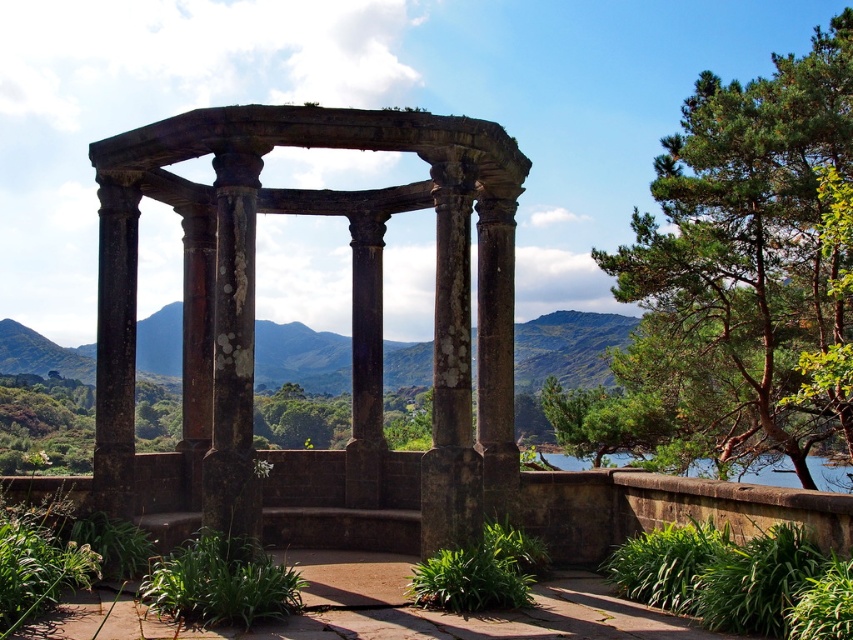
You are standing in the paved area near the dark brown stone gazebo at center and want to take a photo of the green textured tree at upper right. Which direction should you face to capture the tree in your view?

You should face to the right because the green textured tree at upper right is located to the right side of the dark brown stone gazebo at center.

You are planning to install a new pathway between the dark brown stone gazebo at center and the dense cluster of shrubs on the right. The pathway needs to be exactly 60 feet long. Is this feasible?

The distance between the dark brown stone gazebo at center and the dense cluster of shrubs on the right is 62.50 feet. Since the required pathway is 60 feet, it is not feasible as the distance is longer than the specified length.

You are standing at the camera position and want to take a photo of the dark brown stone gazebo at center. If your camera has a maximum focus range of 60 feet, will you be able to capture the gazebo clearly?

The dark brown stone gazebo at center and camera are 62.50 feet apart, which exceeds the camera maximum focus range of 60 feet. Therefore, you won not be able to capture the gazebo clearly.